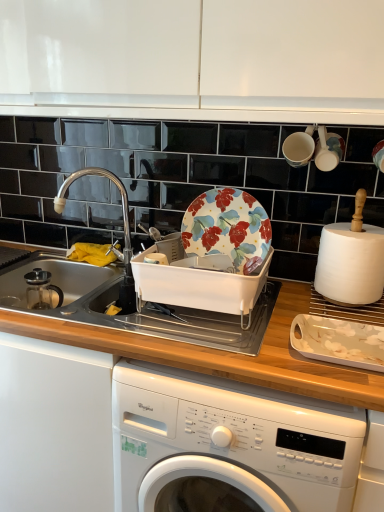
At what (x,y) coordinates should I click in order to perform the action: click on white glossy cup at upper right, arranged as the first tableware when viewed from the left. Please return your answer as a coordinate pair (x, y). Image resolution: width=384 pixels, height=512 pixels. Looking at the image, I should click on (299, 147).

Image resolution: width=384 pixels, height=512 pixels. Describe the element at coordinates (227, 228) in the screenshot. I see `floral ceramic plate at center` at that location.

In order to face polished stainless steel faucet at left, should I rotate leftwards or rightwards?

Turn left approximately 11.888 degrees to face it.

The height and width of the screenshot is (512, 384). I want to click on polished stainless steel faucet at left, so click(121, 199).

Find the location of a particular element. The image size is (384, 512). white matte cup at upper right, the 1th tableware when ordered from right to left is located at coordinates (328, 150).

How many degrees apart are the facing directions of white matte cup at upper right, the 2th tableware from the left, and white glossy cabinet at upper center?

The facing directions of white matte cup at upper right, the 2th tableware from the left, and white glossy cabinet at upper center are 1.11 degrees apart.

Who is bigger, white matte cup at upper right, the 1th tableware when ordered from right to left, or white glossy cabinet at upper center?

white glossy cabinet at upper center is bigger.

From the image's perspective, is white matte cup at upper right, the 2th tableware from the left, over white glossy cabinet at upper center?

No.

Is white matte cup at upper right, the 1th tableware when ordered from right to left, next to white glossy cup at upper right, arranged as the first tableware when viewed from the left, and touching it?

Yes, white matte cup at upper right, the 1th tableware when ordered from right to left, is touching white glossy cup at upper right, arranged as the first tableware when viewed from the left.

Considering the positions of objects white matte cup at upper right, the 2th tableware from the left, and white glossy cup at upper right, the second tableware from the right, in the image provided, who is more to the left, white matte cup at upper right, the 2th tableware from the left, or white glossy cup at upper right, the second tableware from the right,?

From the viewer's perspective, white glossy cup at upper right, the second tableware from the right, appears more on the left side.

How distant is white matte cup at upper right, the 2th tableware from the left, from white glossy cup at upper right, arranged as the first tableware when viewed from the left?

white matte cup at upper right, the 2th tableware from the left, and white glossy cup at upper right, arranged as the first tableware when viewed from the left, are 1.87 inches apart.

From the picture: From the image's perspective, between white matte cup at upper right, the 1th tableware when ordered from right to left, and white glossy cup at upper right, the second tableware from the right, who is located below?

white matte cup at upper right, the 1th tableware when ordered from right to left, appears lower in the image.

How distant is white glossy cabinet at upper center from polished stainless steel faucet at left?

52.03 centimeters.

At what (x,y) coordinates should I click in order to perform the action: click on cabinetry that appears in front of the polished stainless steel faucet at left. Please return your answer as a coordinate pair (x, y). This screenshot has width=384, height=512. Looking at the image, I should click on (194, 59).

From the image's perspective, which one is positioned higher, white glossy cabinet at upper center or polished stainless steel faucet at left?

white glossy cabinet at upper center appears higher in the image.

Are white glossy cabinet at upper center and polished stainless steel faucet at left far apart?

No, there isn't a large distance between white glossy cabinet at upper center and polished stainless steel faucet at left.

Is point (312, 356) behind point (295, 157)?

No.

Can white glossy cup at upper right, arranged as the first tableware when viewed from the left, be found inside white glossy platter at lower right?

Definitely not — white glossy cup at upper right, arranged as the first tableware when viewed from the left, is not inside white glossy platter at lower right.

In terms of height, does white glossy platter at lower right look taller or shorter compared to white glossy cup at upper right, the second tableware from the right?

Considering their sizes, white glossy platter at lower right has less height than white glossy cup at upper right, the second tableware from the right.

Is white glossy platter at lower right at the left side of white glossy cup at upper right, the second tableware from the right?

No.

Does point (198, 426) lie in front of point (311, 129)?

Yes, point (198, 426) is closer to viewer.

From a real-world perspective, between white glossy washing machine at lower center and white glossy cup at upper right, arranged as the first tableware when viewed from the left, who is vertically higher?

white glossy cup at upper right, arranged as the first tableware when viewed from the left, is physically above.

Considering the relative positions of white glossy washing machine at lower center and white glossy cup at upper right, arranged as the first tableware when viewed from the left, in the image provided, is white glossy washing machine at lower center to the right of white glossy cup at upper right, arranged as the first tableware when viewed from the left, from the viewer's perspective?

Incorrect, white glossy washing machine at lower center is not on the right side of white glossy cup at upper right, arranged as the first tableware when viewed from the left.

From the picture: Who is taller, white glossy washing machine at lower center or white glossy cup at upper right, the second tableware from the right?

white glossy washing machine at lower center is taller.

Considering the positions of objects white glossy cup at upper right, the second tableware from the right, and white glossy cabinet at upper center in the image provided, who is more to the left, white glossy cup at upper right, the second tableware from the right, or white glossy cabinet at upper center?

white glossy cabinet at upper center.

Find the location of a particular element. cabinetry above the white glossy cup at upper right, the second tableware from the right (from a real-world perspective) is located at coordinates (194, 59).

Choose the correct answer: Is white glossy cup at upper right, arranged as the first tableware when viewed from the left, inside white glossy cabinet at upper center or outside it?

The correct answer is: outside.

Is white glossy cup at upper right, arranged as the first tableware when viewed from the left, aimed at white glossy washing machine at lower center?

No, white glossy cup at upper right, arranged as the first tableware when viewed from the left, does not turn towards white glossy washing machine at lower center.

Considering the relative sizes of white glossy cup at upper right, arranged as the first tableware when viewed from the left, and white glossy washing machine at lower center in the image provided, is white glossy cup at upper right, arranged as the first tableware when viewed from the left, thinner than white glossy washing machine at lower center?

Indeed, white glossy cup at upper right, arranged as the first tableware when viewed from the left, has a lesser width compared to white glossy washing machine at lower center.

Does white glossy cup at upper right, arranged as the first tableware when viewed from the left, have a greater height compared to white glossy washing machine at lower center?

In fact, white glossy cup at upper right, arranged as the first tableware when viewed from the left, may be shorter than white glossy washing machine at lower center.

From the image's perspective, relative to white glossy washing machine at lower center, is white glossy cup at upper right, arranged as the first tableware when viewed from the left, above or below?

Clearly, from the image's perspective, white glossy cup at upper right, arranged as the first tableware when viewed from the left, is above white glossy washing machine at lower center.

The image size is (384, 512). Find the location of `cabinetry above the white matte cup at upper right, the 1th tableware when ordered from right to left (from a real-world perspective)`. cabinetry above the white matte cup at upper right, the 1th tableware when ordered from right to left (from a real-world perspective) is located at coordinates (194, 59).

At what (x,y) coordinates should I click in order to perform the action: click on tableware in front of the white glossy cup at upper right, the second tableware from the right. Please return your answer as a coordinate pair (x, y). Image resolution: width=384 pixels, height=512 pixels. Looking at the image, I should click on (328, 150).

Based on their spatial positions, is white matte cup at upper right, the 2th tableware from the left, or white glossy cabinet at upper center further from white glossy cup at upper right, arranged as the first tableware when viewed from the left?

white glossy cabinet at upper center lies further to white glossy cup at upper right, arranged as the first tableware when viewed from the left, than the other object.

Estimate the real-world distances between objects in this image. Which object is closer to white glossy cup at upper right, the second tableware from the right, white glossy platter at lower right or floral ceramic plate at center?

floral ceramic plate at center is positioned closer to the anchor white glossy cup at upper right, the second tableware from the right.

Estimate the real-world distances between objects in this image. Which object is further from floral ceramic plate at center, polished stainless steel faucet at left or white glossy platter at lower right?

polished stainless steel faucet at left lies further to floral ceramic plate at center than the other object.

Consider the image. Which object lies further to the anchor point white glossy cup at upper right, the second tableware from the right, floral ceramic plate at center or white matte cup at upper right, the 2th tableware from the left?

The object further to white glossy cup at upper right, the second tableware from the right, is floral ceramic plate at center.

Which object lies nearer to the anchor point white matte cup at upper right, the 2th tableware from the left, polished stainless steel faucet at left or white glossy cup at upper right, the second tableware from the right?

The object closer to white matte cup at upper right, the 2th tableware from the left, is white glossy cup at upper right, the second tableware from the right.

Considering their positions, is white glossy cabinet at upper center positioned further to polished stainless steel faucet at left than white matte paper towel at right?

Among the two, white matte paper towel at right is located further to polished stainless steel faucet at left.

Considering their positions, is white matte paper towel at right positioned further to white glossy platter at lower right than white glossy cup at upper right, the second tableware from the right?

Among the two, white glossy cup at upper right, the second tableware from the right, is located further to white glossy platter at lower right.

Estimate the real-world distances between objects in this image. Which object is closer to polished stainless steel faucet at left, white glossy washing machine at lower center or white matte cup at upper right, the 2th tableware from the left?

white glossy washing machine at lower center lies closer to polished stainless steel faucet at left than the other object.

This screenshot has height=512, width=384. Find the location of `tableware between white glossy cabinet at upper center and white matte cup at upper right, the 2th tableware from the left, from left to right`. tableware between white glossy cabinet at upper center and white matte cup at upper right, the 2th tableware from the left, from left to right is located at coordinates (299, 147).

This screenshot has width=384, height=512. What are the coordinates of `paper towel that lies between white glossy cabinet at upper center and white glossy platter at lower right from top to bottom` in the screenshot? It's located at (350, 264).

You are a GUI agent. You are given a task and a screenshot of the screen. Output one action in this format:
    pyautogui.click(x=<x>, y=<y>)
    Task: Click on the plate between white glossy cup at upper right, the second tableware from the right, and white glossy platter at lower right vertically
    The image size is (384, 512).
    Given the screenshot: What is the action you would take?
    pyautogui.click(x=227, y=228)

The image size is (384, 512). I want to click on plate between white glossy cabinet at upper center and white matte paper towel at right in the up-down direction, so click(x=227, y=228).